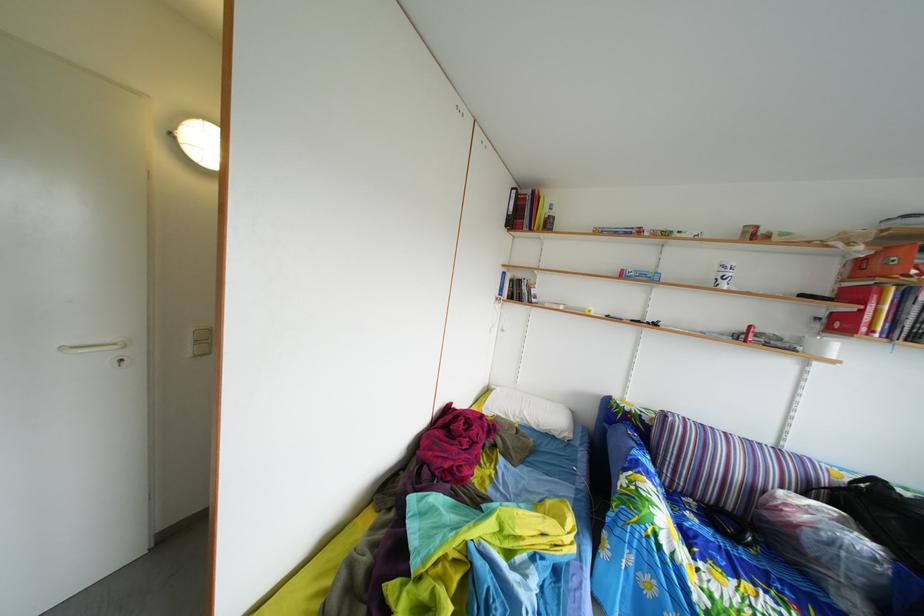
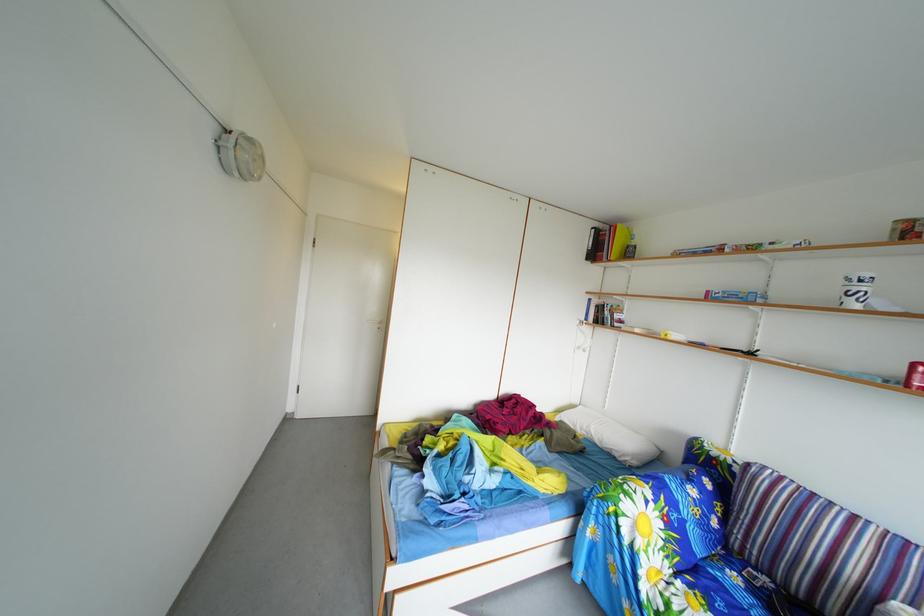
In the second image, find the point that corresponds to pixel 549 434 in the first image.

(612, 451)